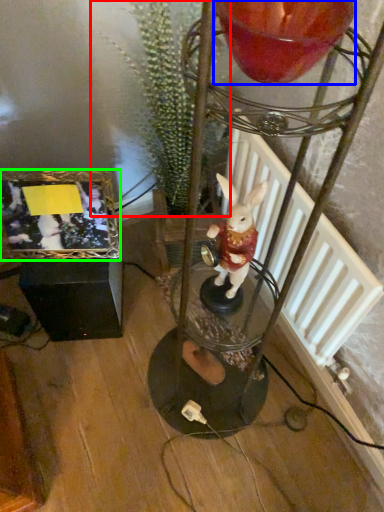
Question: Based on their relative distances, which object is farther from plant (highlighted by a red box)? Choose from candle holder (highlighted by a blue box) and picture frame (highlighted by a green box).

Choices:
 (A) candle holder
 (B) picture frame

Answer: (A)